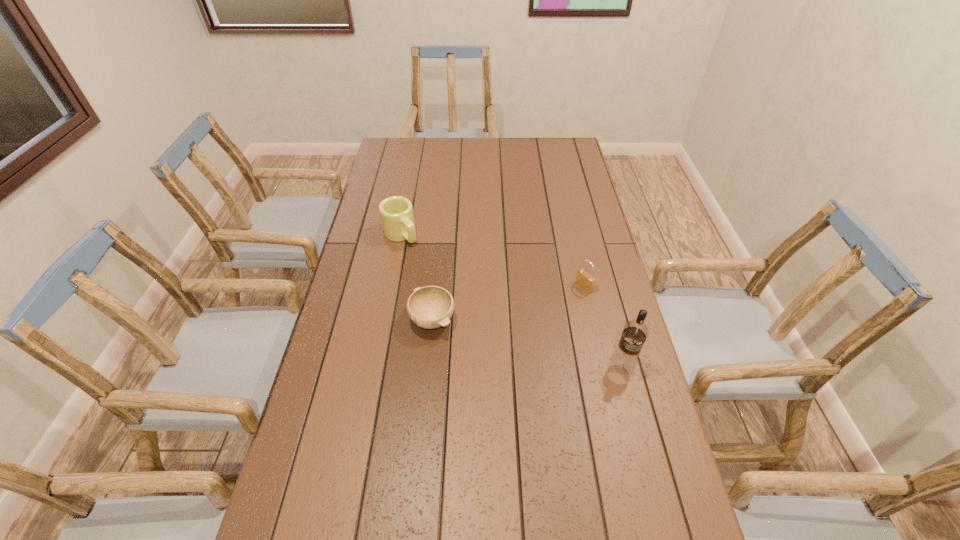
Identify the location of vacant area located 0.130m with the handle on the side of the mug. (430, 266).

Where is `vacant region located with the handle on the side of the mug`? The height and width of the screenshot is (540, 960). vacant region located with the handle on the side of the mug is located at coordinates (460, 298).

Identify the location of blank area located with the handle on the side of the mug. The height and width of the screenshot is (540, 960). (473, 311).

Where is `vacant position located 0.230m on the front-facing side of the second farthest object`? The width and height of the screenshot is (960, 540). vacant position located 0.230m on the front-facing side of the second farthest object is located at coordinates (524, 323).

Find the location of `free location located 0.140m on the front-facing side of the second farthest object`. free location located 0.140m on the front-facing side of the second farthest object is located at coordinates (546, 310).

Identify the location of free region located 0.140m on the front-facing side of the second farthest object. (546, 310).

Image resolution: width=960 pixels, height=540 pixels. Find the location of `object present at the left edge`. object present at the left edge is located at coordinates (396, 213).

Where is `vodka that is at the right edge`? This screenshot has height=540, width=960. vodka that is at the right edge is located at coordinates (635, 332).

Identify the location of padlock that is at the right edge. (586, 281).

The width and height of the screenshot is (960, 540). In the image, there is a desktop. Find the location of `vacant region at the far edge`. vacant region at the far edge is located at coordinates (450, 148).